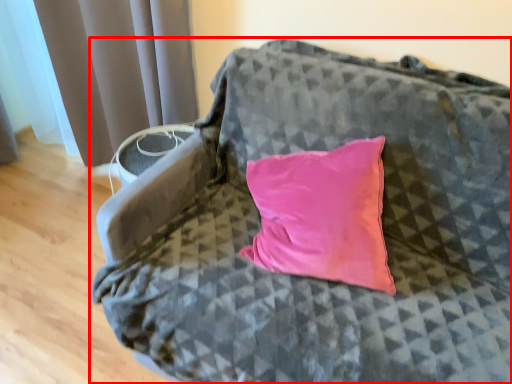
Question: From the image, what is the correct spatial relationship of furniture (annotated by the red box) in relation to curtain?

Choices:
 (A) left
 (B) right

Answer: (B)